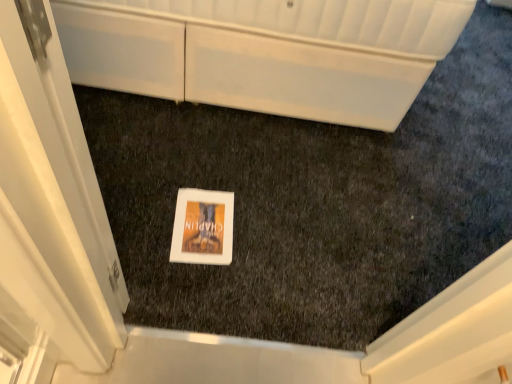
Where is `vacant area that is in front of white glossy cabinet at upper center`? The width and height of the screenshot is (512, 384). vacant area that is in front of white glossy cabinet at upper center is located at coordinates (234, 199).